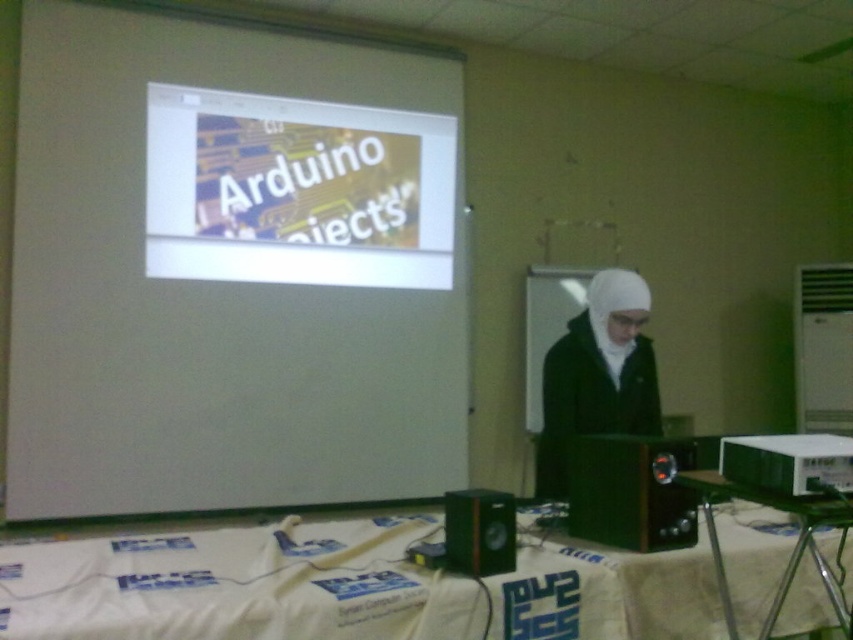
Question: Is white matte projector screen at upper center behind black plastic speaker at lower center?

Choices:
 (A) yes
 (B) no

Answer: (A)

Question: Which object is the farthest from the white plastic projector at lower right?

Choices:
 (A) white matte projector screen at upper center
 (B) white matte projection screen at upper left

Answer: (A)

Question: Where is metallic black speaker at lower right located in relation to black plastic speaker at lower center in the image?

Choices:
 (A) left
 (B) right

Answer: (B)

Question: Which point appears closest to the camera in this image?

Choices:
 (A) (485, 570)
 (B) (642, 404)
 (C) (247, 227)
 (D) (390, 164)

Answer: (A)

Question: Observing the image, what is the correct spatial positioning of white matte projection screen at upper left in reference to black plastic speaker at lower center?

Choices:
 (A) below
 (B) above

Answer: (B)

Question: Among these points, which one is nearest to the camera?

Choices:
 (A) (351, 116)
 (B) (846, 472)
 (C) (457, 540)

Answer: (B)